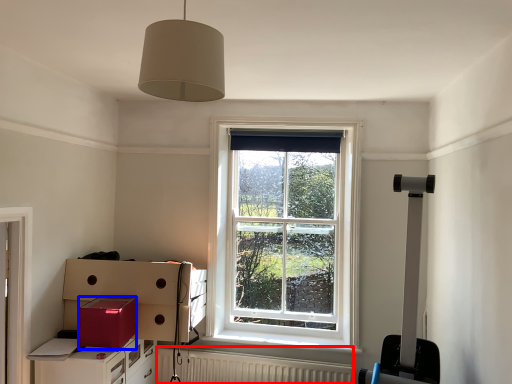
Question: Which of the following is the farthest to the observer, radiator (highlighted by a red box) or cardboard box (highlighted by a blue box)?

Choices:
 (A) radiator
 (B) cardboard box

Answer: (A)